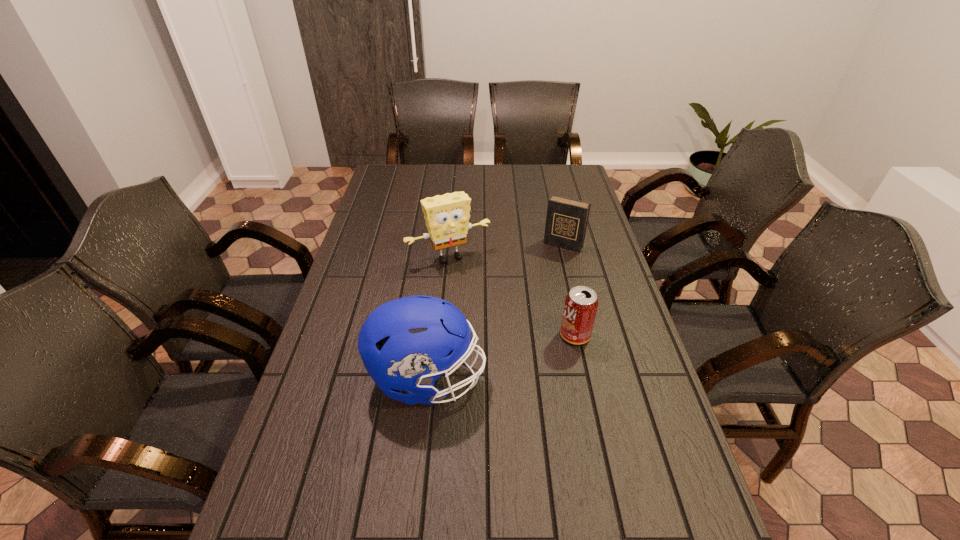
This screenshot has height=540, width=960. What are the coordinates of `free space that is in between the sponge and the diary` in the screenshot? It's located at (506, 251).

This screenshot has width=960, height=540. Find the location of `free space between the shortest object and the football helmet`. free space between the shortest object and the football helmet is located at coordinates (501, 357).

Select which object is the third closest to the football helmet. Please provide its 2D coordinates. Your answer should be formatted as a tuple, i.e. [(x, y)], where the tuple contains the x and y coordinates of a point satisfying the conditions above.

[(566, 222)]

Locate which object ranks second in proximity to the diary. Please provide its 2D coordinates. Your answer should be formatted as a tuple, i.e. [(x, y)], where the tuple contains the x and y coordinates of a point satisfying the conditions above.

[(580, 307)]

Where is `vacant space that satisfies the following two spatial constraints: 1. on the front side of the sponge; 2. on the left side of the soda can`? The height and width of the screenshot is (540, 960). vacant space that satisfies the following two spatial constraints: 1. on the front side of the sponge; 2. on the left side of the soda can is located at coordinates (443, 335).